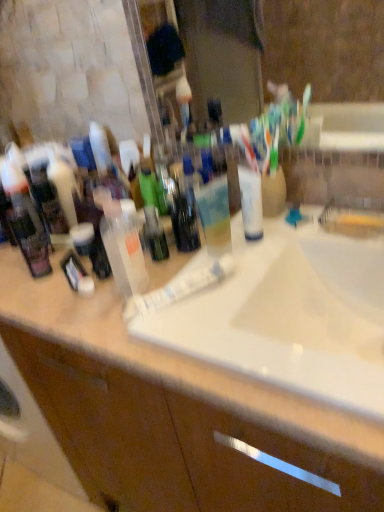
This screenshot has height=512, width=384. In order to click on free spot in front of white plastic tube at center in this screenshot , I will do `click(250, 293)`.